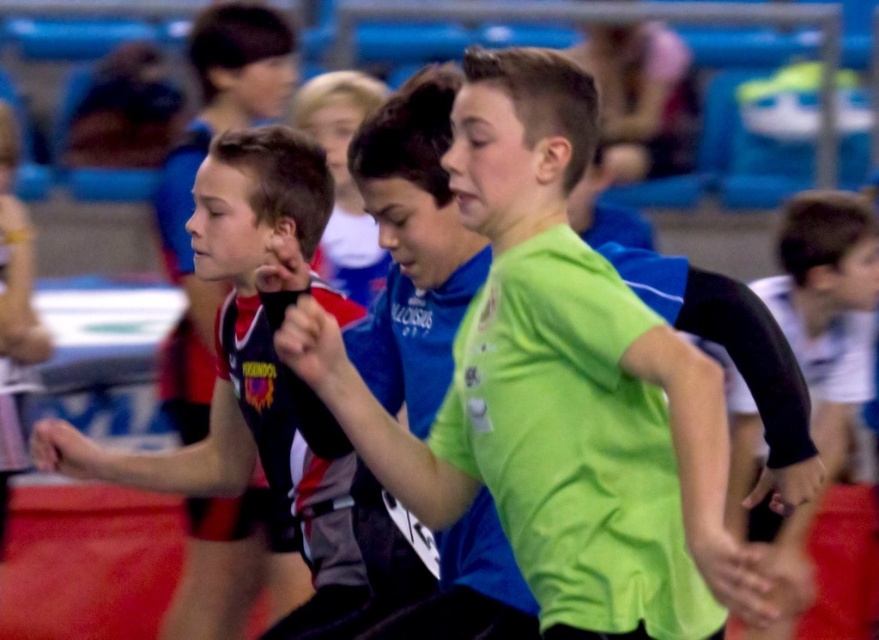
You are a photographer trying to capture a closeup shot of the neon green jersey at center and the matte black jersey at left. Given that your camera can only focus on objects within a 1.2 meter width, will both jerseys fit within the frame?

The neon green jersey at center has a larger width than the matte black jersey at left. Since the camera can only focus on objects within a 1.2 meter width, and the neon green jersey at center is wider than the matte black jersey at left, it is possible that the neon green jersey at center may exceed the frame. Therefore, both jerseys might not fit within the 1.2 meter width frame.

You are a photographer standing at the starting line of the relay race. You want to take a photo of the two points in the image. Which point, point (556, 474) or point (258, 244), will appear larger in your photo?

Point (556, 474) will appear larger in the photo because it is closer to the camera than point (258, 244).